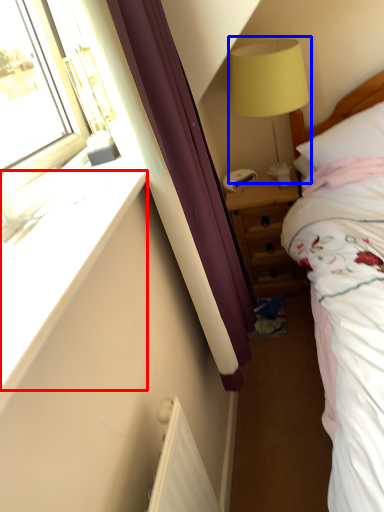
Question: Which object appears farthest to the camera in this image, window sill (highlighted by a red box) or table lamp (highlighted by a blue box)?

Choices:
 (A) window sill
 (B) table lamp

Answer: (B)